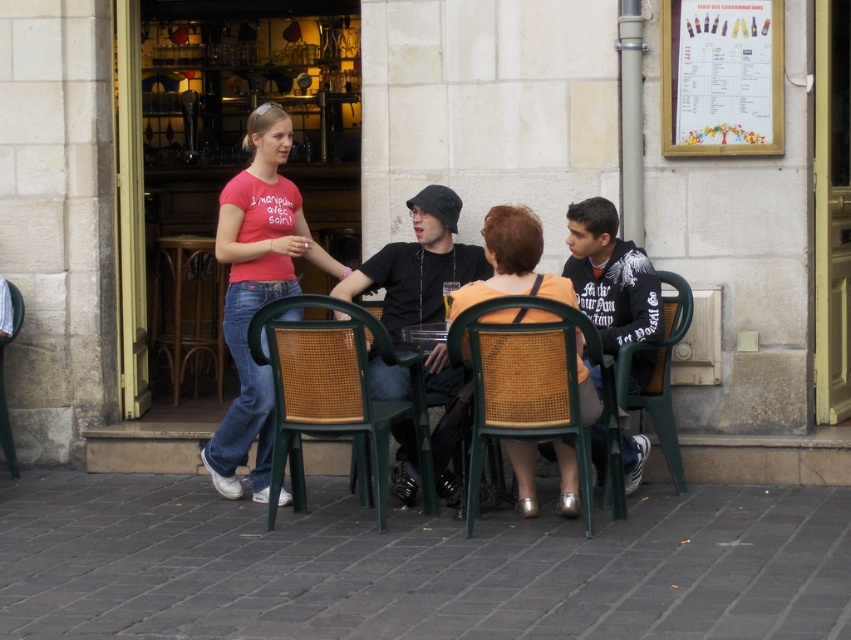
Measure the distance between woven cane chair at center and green plastic chair at lower right.

The distance of woven cane chair at center from green plastic chair at lower right is 29.17 inches.

Does woven cane chair at center have a lesser height compared to green plastic chair at lower right?

Yes.

Where is `woven cane chair at center`? The image size is (851, 640). woven cane chair at center is located at coordinates (524, 401).

The height and width of the screenshot is (640, 851). Identify the location of woven cane chair at center. (524, 401).

Describe the element at coordinates (524, 401) in the screenshot. I see `woven cane chair at center` at that location.

Can you confirm if woven cane chair at center is thinner than brown wicker table at left?

No.

I want to click on woven cane chair at center, so click(x=524, y=401).

You are a GUI agent. You are given a task and a screenshot of the screen. Output one action in this format:
    pyautogui.click(x=<x>, y=<y>)
    Task: Click on the woven cane chair at center
    This screenshot has height=640, width=851.
    Given the screenshot: What is the action you would take?
    pyautogui.click(x=524, y=401)

Looking at this image, does matte pink t-shirt at center appear under green plastic chair at lower left?

Incorrect, matte pink t-shirt at center is not positioned below green plastic chair at lower left.

Looking at this image, between matte pink t-shirt at center and green plastic chair at lower left, which one is positioned higher?

matte pink t-shirt at center is higher up.

Between point (216, 436) and point (15, 465), which one is positioned in front?

Point (216, 436) is more forward.

Locate an element on the screen. matte pink t-shirt at center is located at coordinates (256, 289).